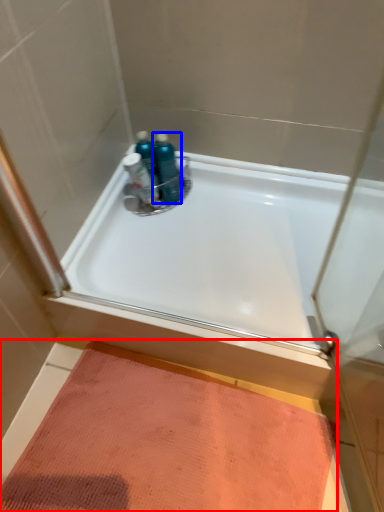
Question: Which of the following is the farthest to the observer, doormat (highlighted by a red box) or toiletry (highlighted by a blue box)?

Choices:
 (A) doormat
 (B) toiletry

Answer: (B)